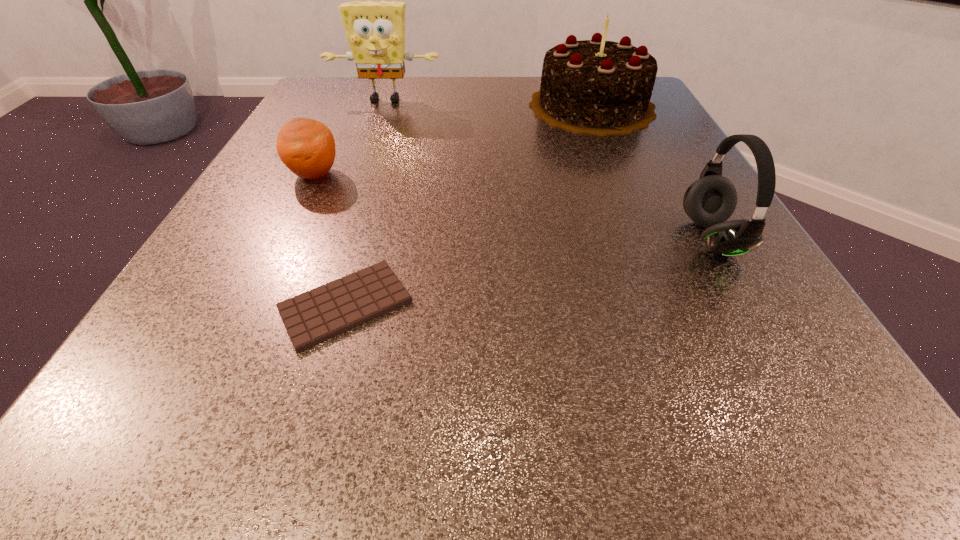
At what (x,y) coordinates should I click in order to perform the action: click on free space between the sponge and the shortest object. Please return your answer as a coordinate pair (x, y). This screenshot has height=540, width=960. Looking at the image, I should click on (366, 202).

Where is `vacant point located between the third shortest object and the third farthest object`? The height and width of the screenshot is (540, 960). vacant point located between the third shortest object and the third farthest object is located at coordinates (513, 206).

The width and height of the screenshot is (960, 540). Find the location of `free space between the second shortest object and the sponge`. free space between the second shortest object and the sponge is located at coordinates (349, 137).

The height and width of the screenshot is (540, 960). Find the location of `vacant region between the shortest object and the birthday cake`. vacant region between the shortest object and the birthday cake is located at coordinates (468, 205).

At what (x,y) coordinates should I click in order to perform the action: click on free space between the third farthest object and the headset. Please return your answer as a coordinate pair (x, y). Looking at the image, I should click on (513, 206).

Where is `vacant space that is in between the orange and the chocolate bar`? The image size is (960, 540). vacant space that is in between the orange and the chocolate bar is located at coordinates (329, 239).

Find the location of a particular element. This screenshot has height=540, width=960. empty location between the third shortest object and the sponge is located at coordinates (548, 168).

Locate which object ranks third in proximity to the third farthest object. Please provide its 2D coordinates. Your answer should be formatted as a tuple, i.e. [(x, y)], where the tuple contains the x and y coordinates of a point satisfying the conditions above.

[(598, 87)]

Where is `object that is the closest to the shortest object`? This screenshot has width=960, height=540. object that is the closest to the shortest object is located at coordinates (306, 146).

Where is `blank space that satisfies the following two spatial constraints: 1. on the ear cups of the third tallest object; 2. on the front side of the chocolate bar`? blank space that satisfies the following two spatial constraints: 1. on the ear cups of the third tallest object; 2. on the front side of the chocolate bar is located at coordinates (749, 305).